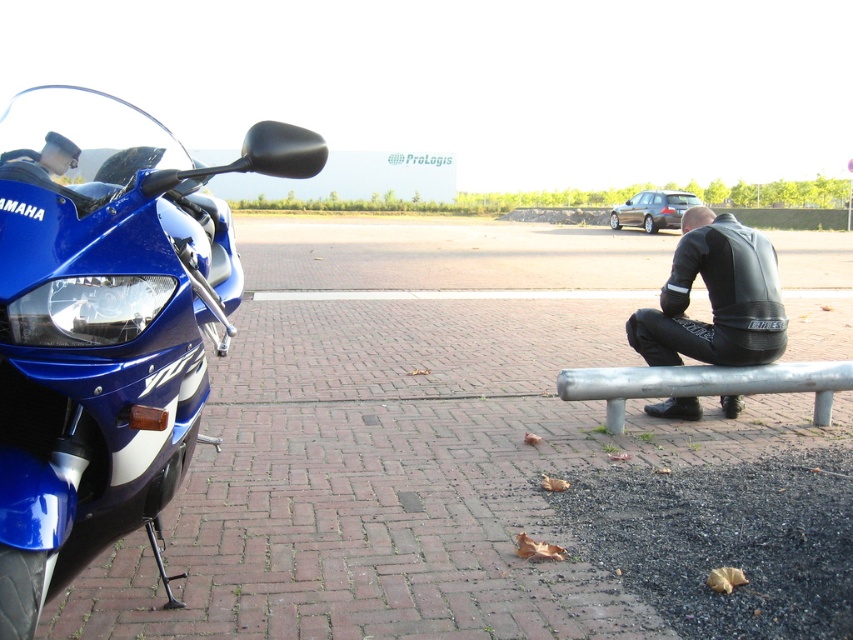
Question: Which of the following is the farthest from the observer?

Choices:
 (A) black leather jacket at center
 (B) silver metallic bench at lower right

Answer: (A)

Question: Is brick pavement at lower left wider than black leather jacket at center?

Choices:
 (A) yes
 (B) no

Answer: (A)

Question: Is brick pavement at lower left smaller than blue glossy motorcycle at left?

Choices:
 (A) yes
 (B) no

Answer: (B)

Question: Which object is positioned farthest from the brick pavement at lower left?

Choices:
 (A) black leather jacket at center
 (B) blue glossy motorcycle at left

Answer: (A)

Question: Is black leather jacket at center smaller than silver metallic bench at lower right?

Choices:
 (A) yes
 (B) no

Answer: (B)

Question: Which of the following is the closest to the observer?

Choices:
 (A) silver metallic bench at lower right
 (B) blue glossy motorcycle at left
 (C) brick pavement at lower left
 (D) black leather jacket at center

Answer: (B)